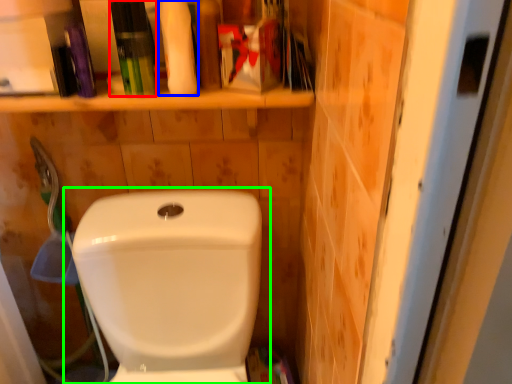
Question: Estimate the real-world distances between objects in this image. Which object is closer to toiletry (highlighted by a red box), cleaning product (highlighted by a blue box) or toilet (highlighted by a green box)?

Choices:
 (A) cleaning product
 (B) toilet

Answer: (A)